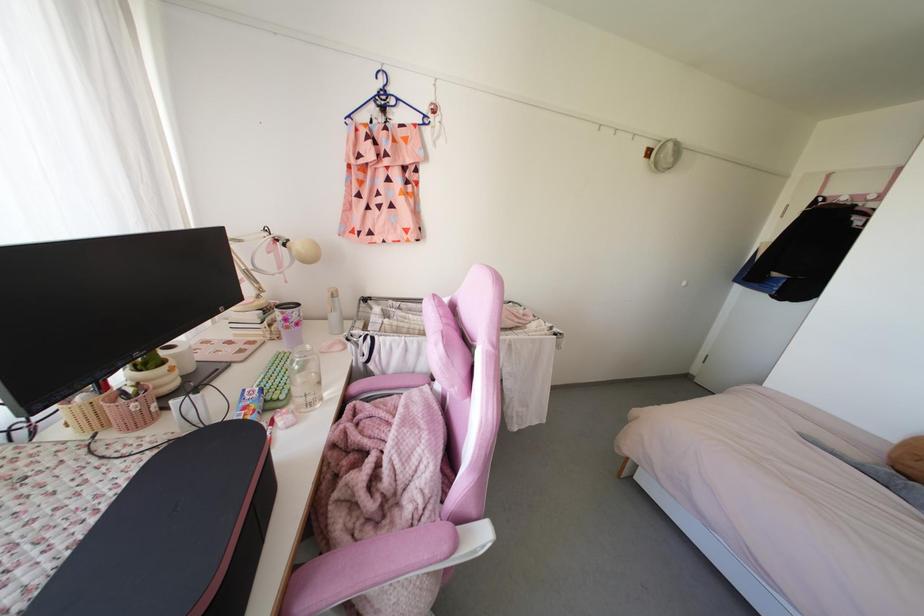
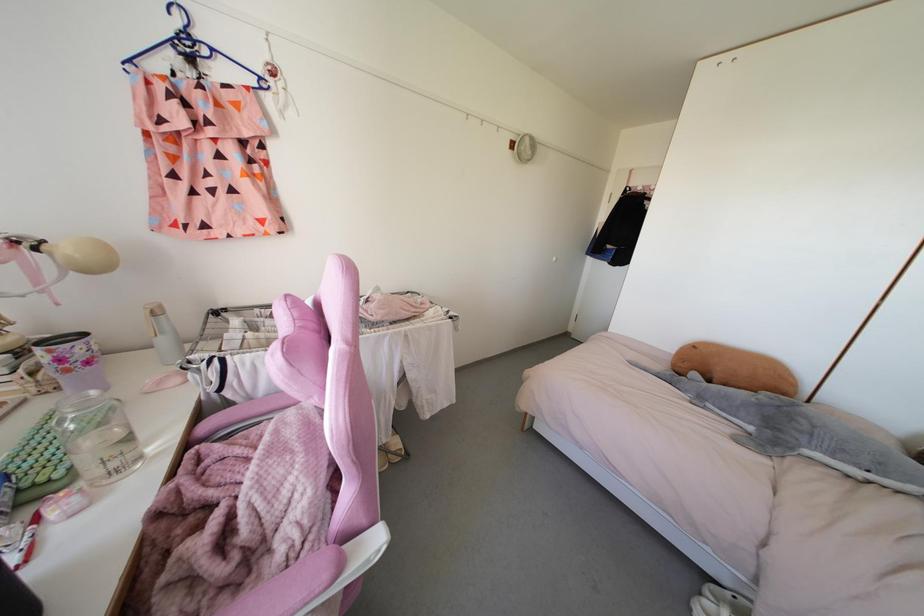
The point at (307,346) is marked in the first image. Where is the corresponding point in the second image?

(92, 392)